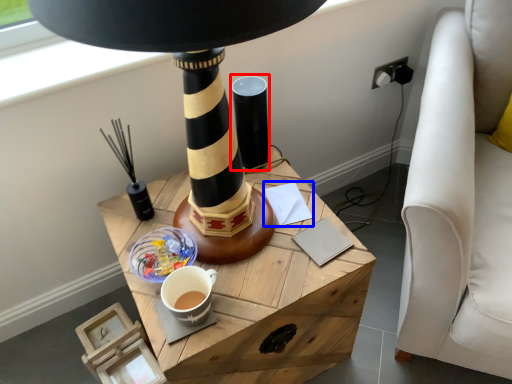
Question: Among these objects, which one is nearest to the camera, candle holder (highlighted by a red box) or notepad (highlighted by a blue box)?

Choices:
 (A) candle holder
 (B) notepad

Answer: (A)